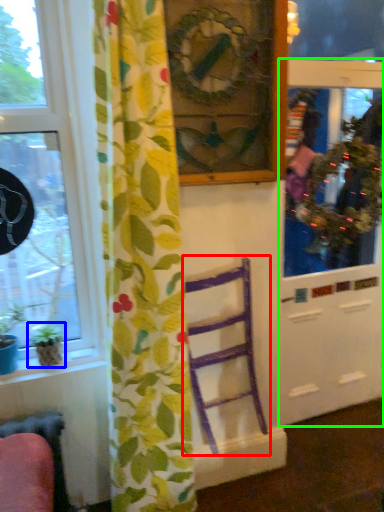
Question: Which object is the closest to the furniture (highlighted by a red box)? Choose among these: houseplant (highlighted by a blue box) or screen door (highlighted by a green box).

Choices:
 (A) houseplant
 (B) screen door

Answer: (B)